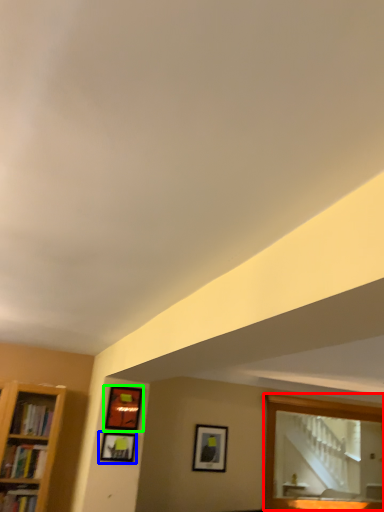
Question: Which object is positioned farthest from mirror (highlighted by a red box)? Select from picture frame (highlighted by a blue box) and picture frame (highlighted by a green box).

Choices:
 (A) picture frame
 (B) picture frame

Answer: (A)